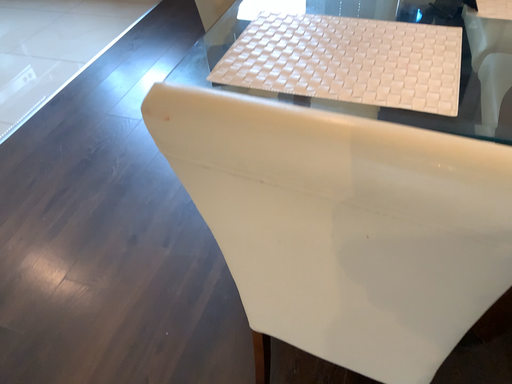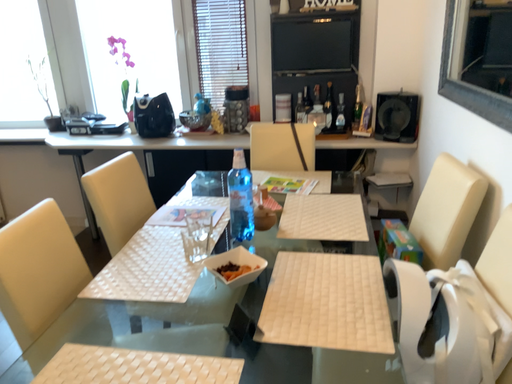
Question: How did the camera likely rotate when shooting the video?

Choices:
 (A) rotated right
 (B) rotated left

Answer: (A)